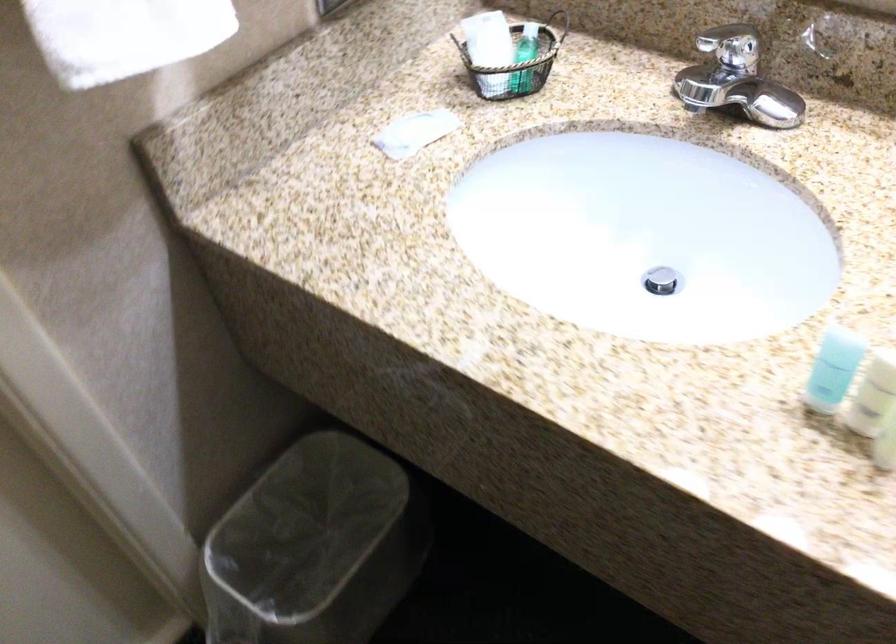
At what (x,y) coordinates should I click in order to perform the action: click on small blue bottle. Please return your answer as a coordinate pair (x, y). Looking at the image, I should click on (833, 368).